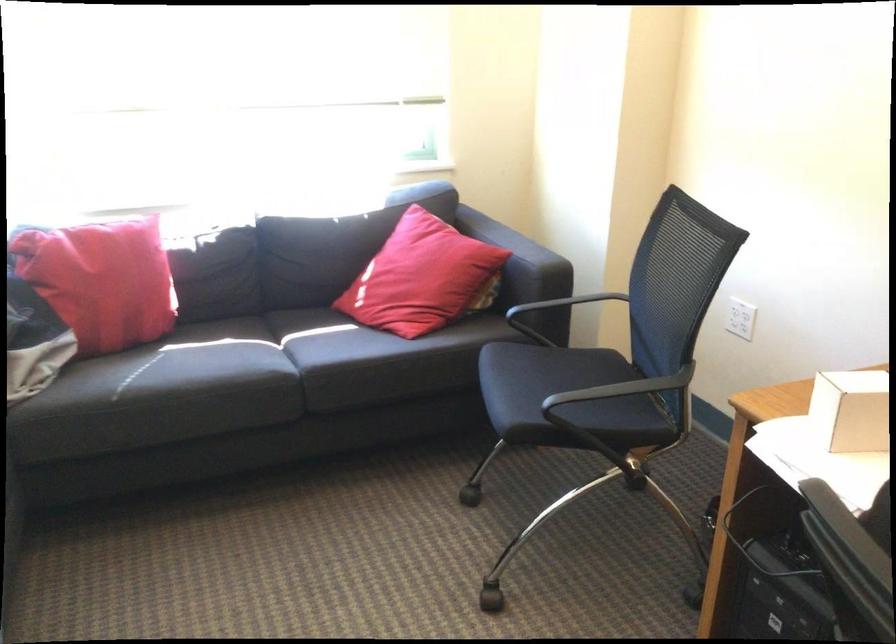
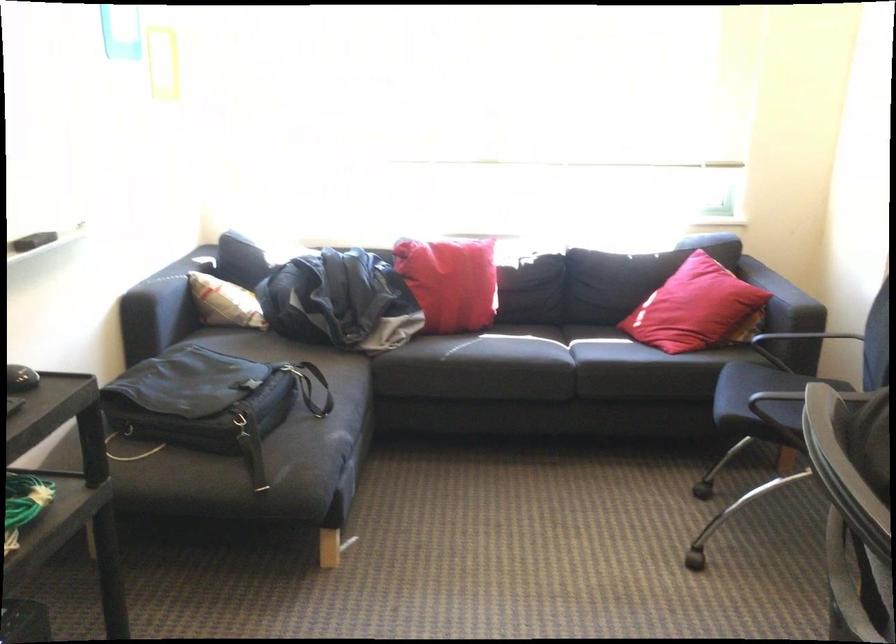
Where in the second image is the point corresponding to point 546,301 from the first image?

(802, 337)